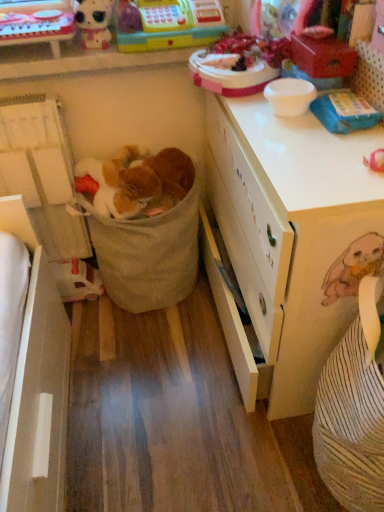
Question: Is matte plastic toy at upper left located within white matte desk at center?

Choices:
 (A) yes
 (B) no

Answer: (B)

Question: Is white matte desk at center shorter than matte plastic toy at upper left?

Choices:
 (A) yes
 (B) no

Answer: (B)

Question: Is white matte desk at center looking in the opposite direction of matte plastic toy at upper left?

Choices:
 (A) yes
 (B) no

Answer: (B)

Question: From a real-world perspective, does white matte desk at center stand above matte plastic toy at upper left?

Choices:
 (A) no
 (B) yes

Answer: (A)

Question: Does white matte desk at center come behind matte plastic toy at upper left?

Choices:
 (A) yes
 (B) no

Answer: (B)

Question: Is matte plastic doll at upper left, which ranks as the 4th toy in bottom-to-top order, bigger or smaller than white matte desk at center?

Choices:
 (A) big
 (B) small

Answer: (B)

Question: Visually, is matte plastic doll at upper left, placed as the 1th toy when sorted from top to bottom, positioned to the left or to the right of white matte desk at center?

Choices:
 (A) right
 (B) left

Answer: (B)

Question: Is matte plastic doll at upper left, which ranks as the 4th toy in bottom-to-top order, wider or thinner than white matte desk at center?

Choices:
 (A) thin
 (B) wide

Answer: (A)

Question: Considering their positions, is matte plastic doll at upper left, placed as the 1th toy when sorted from top to bottom, located in front of or behind white matte desk at center?

Choices:
 (A) front
 (B) behind

Answer: (B)

Question: Is white matte desk at center bigger or smaller than plastic toy cash register at upper center, arranged as the third toy when ordered from the bottom?

Choices:
 (A) big
 (B) small

Answer: (A)

Question: Which is correct: white matte desk at center is inside plastic toy cash register at upper center, arranged as the third toy when ordered from the bottom, or outside of it?

Choices:
 (A) inside
 (B) outside

Answer: (B)

Question: From a real-world perspective, relative to plastic toy cash register at upper center, the second toy in the top-to-bottom sequence, is white matte desk at center vertically above or below?

Choices:
 (A) above
 (B) below

Answer: (B)

Question: Considering the positions of white matte desk at center and plastic toy cash register at upper center, the second toy in the top-to-bottom sequence, in the image, is white matte desk at center wider or thinner than plastic toy cash register at upper center, the second toy in the top-to-bottom sequence,?

Choices:
 (A) thin
 (B) wide

Answer: (B)

Question: Considering their positions, is matte plastic doll at upper left, which ranks as the 4th toy in bottom-to-top order, located in front of or behind white plastic toy at lower left, placed as the first toy when sorted from bottom to top?

Choices:
 (A) behind
 (B) front

Answer: (B)

Question: Based on their positions, is matte plastic doll at upper left, placed as the 1th toy when sorted from top to bottom, located to the left or right of white plastic toy at lower left, placed as the first toy when sorted from bottom to top?

Choices:
 (A) right
 (B) left

Answer: (A)